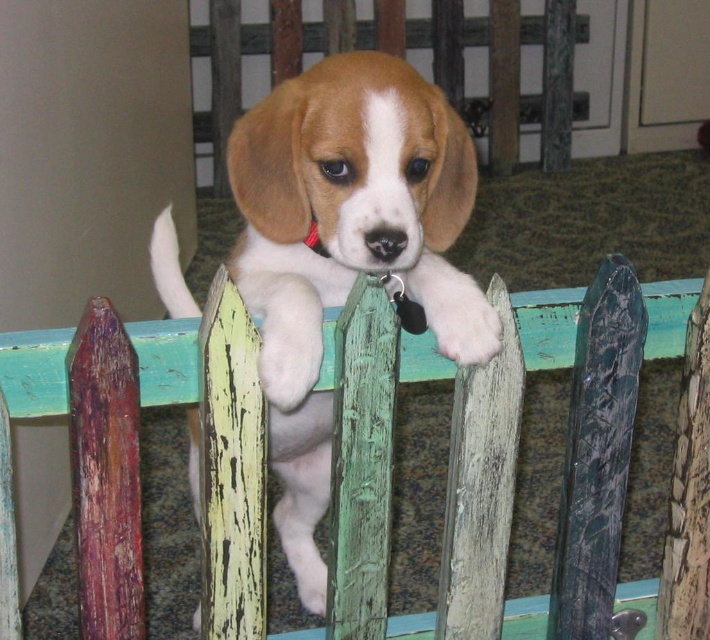
Is point (209, 547) farther from camera compared to point (474, 189)?

No, (209, 547) is in front of (474, 189).

Is wooden picket fence at center thinner than light brown fur at center?

Incorrect, wooden picket fence at center's width is not less than light brown fur at center's.

Which is in front, point (163, 340) or point (253, 298)?

Point (163, 340) is more forward.

Image resolution: width=710 pixels, height=640 pixels. Find the location of `wooden picket fence at center`. wooden picket fence at center is located at coordinates (138, 456).